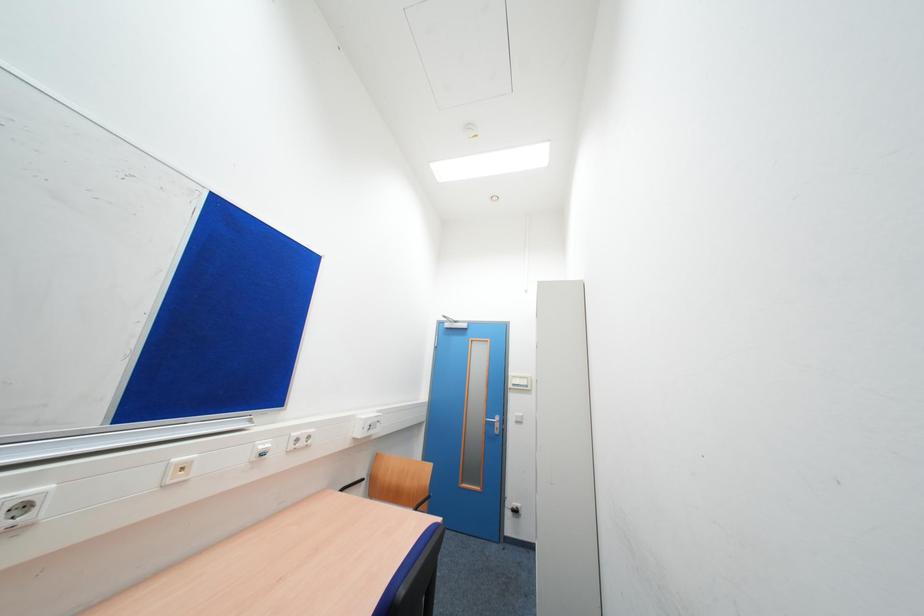
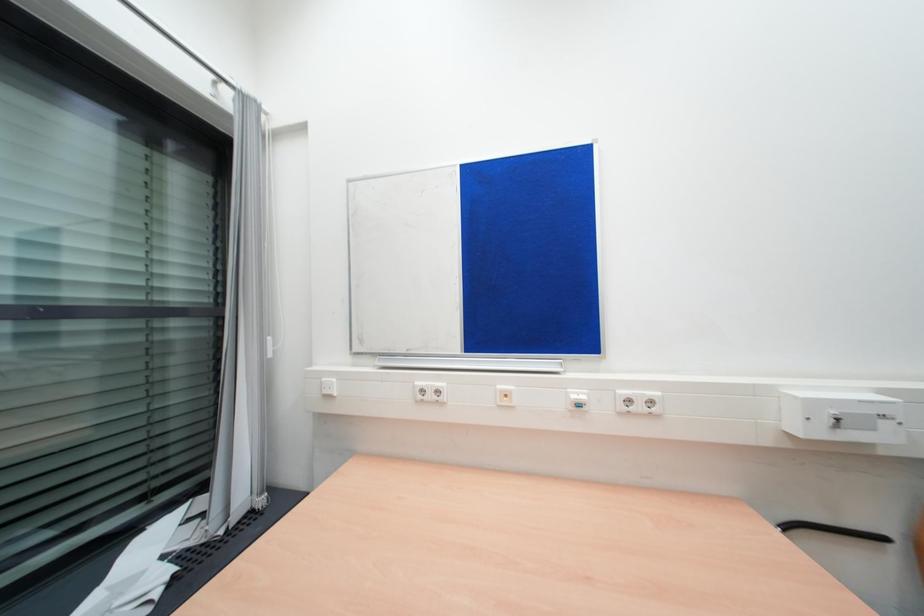
Question: Based on the continuous images, in which direction is the camera rotating? Reply with the corresponding letter.

Choices:
 (A) Left
 (B) Right
 (C) Up
 (D) Down

Answer: (A)